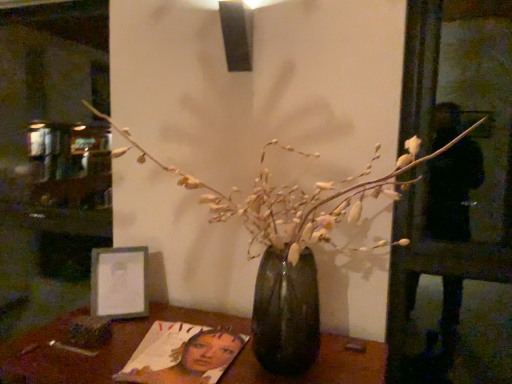
Image resolution: width=512 pixels, height=384 pixels. In order to click on empty space that is ontop of matte paper magazine at lower center (from a real-world perspective) in this screenshot , I will do `click(181, 351)`.